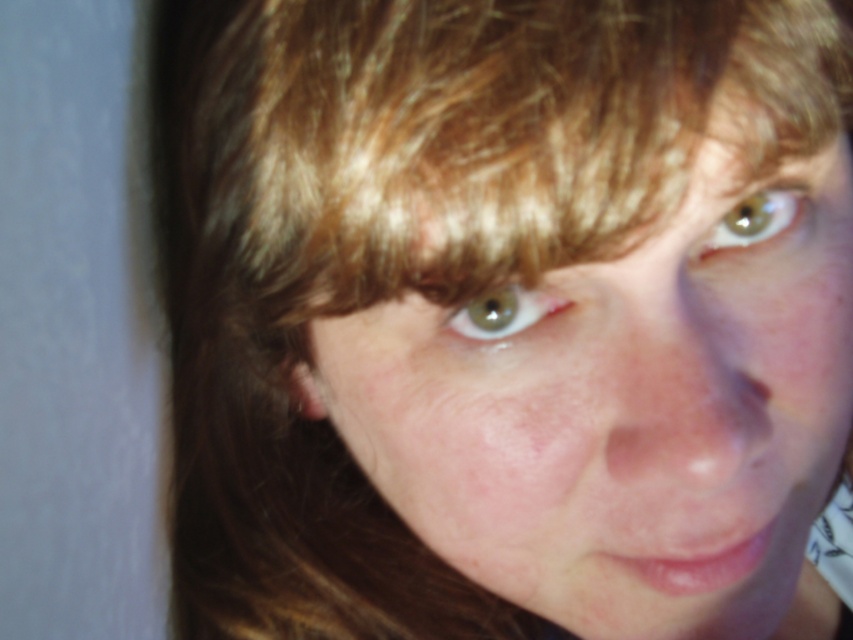
Question: Considering the relative positions of smooth skin face at center and green matte eye at upper right in the image provided, where is smooth skin face at center located with respect to green matte eye at upper right?

Choices:
 (A) below
 (B) above

Answer: (A)

Question: Estimate the real-world distances between objects in this image. Which object is closer to the smooth skin face at center?

Choices:
 (A) blonde hair at upper center
 (B) green matte eye at upper right

Answer: (A)

Question: Can you confirm if blonde hair at upper center is positioned to the right of green matte eye at center?

Choices:
 (A) no
 (B) yes

Answer: (A)

Question: Does blonde hair at upper center have a larger size compared to green matte eye at center?

Choices:
 (A) no
 (B) yes

Answer: (B)

Question: Among these points, which one is farthest from the camera?

Choices:
 (A) (662, 502)
 (B) (589, 20)

Answer: (A)

Question: Among these points, which one is nearest to the camera?

Choices:
 (A) (433, 337)
 (B) (306, 230)
 (C) (508, 316)

Answer: (B)